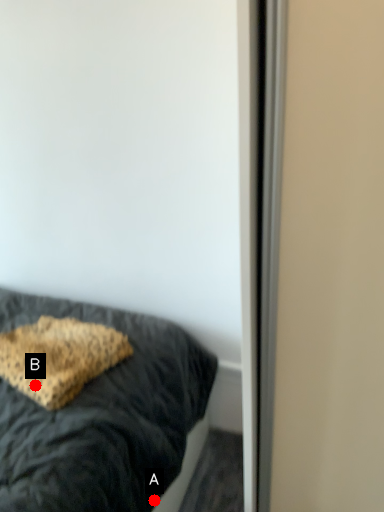
Question: Two points are circled on the image, labeled by A and B beside each circle. Which point appears farthest from the camera in this image?

Choices:
 (A) A is further
 (B) B is further

Answer: (A)